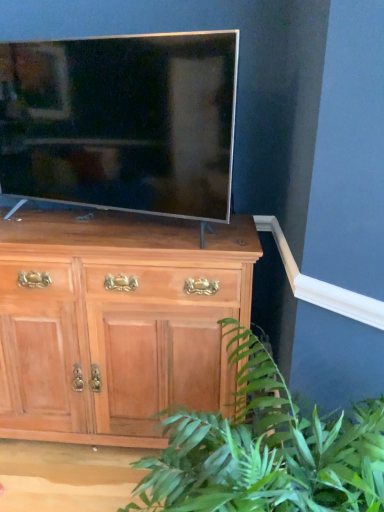
Question: From the image's perspective, is light brown wood chest of drawers at center located above or below satin silver tv at center?

Choices:
 (A) above
 (B) below

Answer: (B)

Question: Considering the positions of light brown wood chest of drawers at center and satin silver tv at center in the image, is light brown wood chest of drawers at center taller or shorter than satin silver tv at center?

Choices:
 (A) tall
 (B) short

Answer: (A)

Question: Which of these objects is positioned closest to the green leafy plant at lower right?

Choices:
 (A) satin silver tv at center
 (B) light brown wood chest of drawers at center

Answer: (B)

Question: Which object is positioned closest to the satin silver tv at center?

Choices:
 (A) light brown wood chest of drawers at center
 (B) green leafy plant at lower right

Answer: (A)